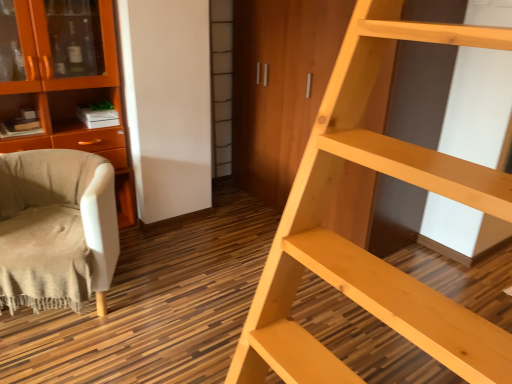
Question: Is light wood ladder at right in front of or behind orange wood cabinet at left in the image?

Choices:
 (A) behind
 (B) front

Answer: (B)

Question: Looking at their shapes, would you say light wood ladder at right is wider or thinner than orange wood cabinet at left?

Choices:
 (A) wide
 (B) thin

Answer: (A)

Question: Which is farther from the light wood ladder at right?

Choices:
 (A) beige fabric chair at left
 (B) orange wood cabinet at left

Answer: (B)

Question: Which object is positioned closest to the beige fabric chair at left?

Choices:
 (A) orange wood cabinet at left
 (B) light wood ladder at right

Answer: (A)